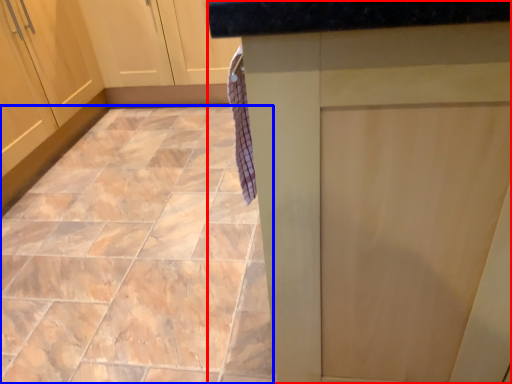
Question: Which point is closer to the camera, counter (highlighted by a red box) or ceramic tile (highlighted by a blue box)?

Choices:
 (A) counter
 (B) ceramic tile

Answer: (A)